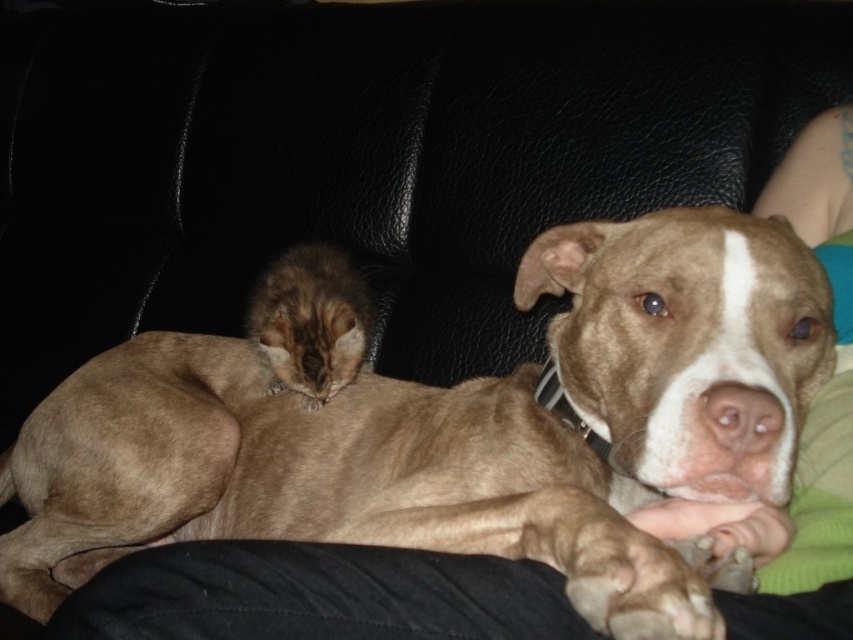
You are a photographer trying to capture a closeup of both the brown fur dog at center and the fuzzy brown cat at center. Since you want both to be in focus, you need to adjust the camera settings. Which animal should you focus on to ensure both are sharp?

You should focus on the brown fur dog at center because it is larger in width than the fuzzy brown cat at center, so focusing on the larger subject will help keep both in focus.

Looking at this image, where is the brown fur dog at center located in the image?

The brown fur dog at center is located at point 0.673 on the x axis and 0.540 on the y axis.